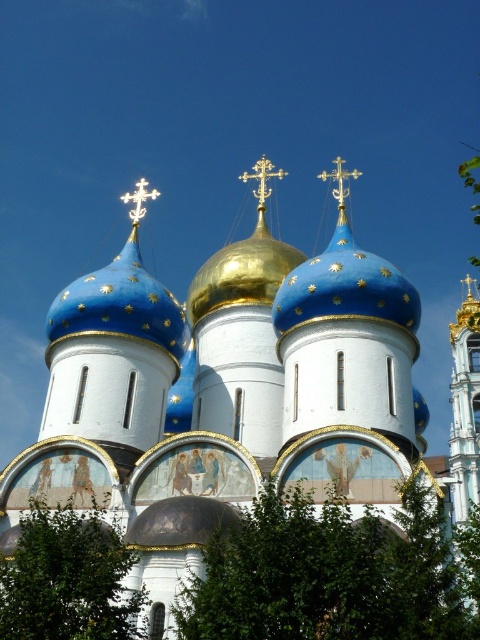
Is point (70, 544) in front of point (273, 176)?

Yes.

Between point (106, 632) and point (262, 164), which one is positioned in front?

Point (106, 632) is in front.

Find the location of `green leafy tree at lower left`. green leafy tree at lower left is located at coordinates [x=68, y=579].

Looking at this image, can you confirm if green leafy tree at center is shorter than blue glossy dome at upper center?

Yes.

At what (x,y) coordinates should I click in order to perform the action: click on green leafy tree at center. Please return your answer as a coordinate pair (x, y). This screenshot has width=480, height=640. Looking at the image, I should click on (336, 573).

The width and height of the screenshot is (480, 640). Identify the location of white metallic cross at upper left. (139, 198).

Measure the distance from white metallic cross at upper left to gold metallic cross at upper center.

white metallic cross at upper left is 37.06 meters from gold metallic cross at upper center.

I want to click on white metallic cross at upper left, so click(139, 198).